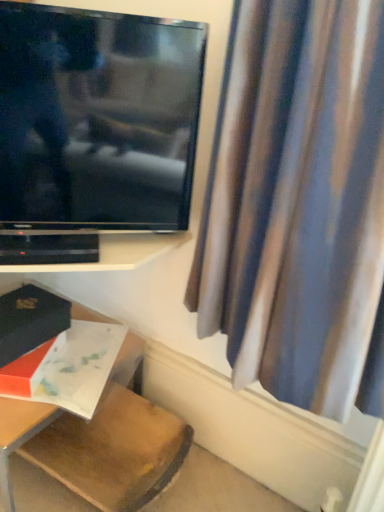
Where is `vacant region above black plastic shelf at lower left (from a real-world perspective)`? The image size is (384, 512). vacant region above black plastic shelf at lower left (from a real-world perspective) is located at coordinates (92, 251).